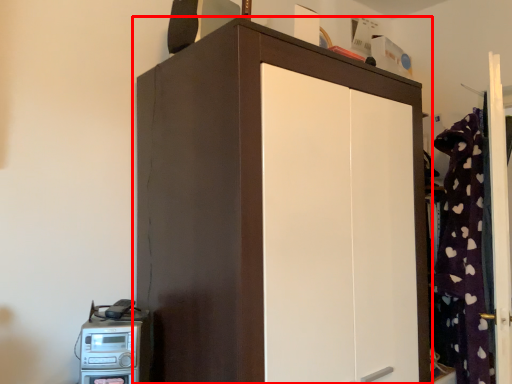
Question: Observing the image, what is the correct spatial positioning of cupboard (annotated by the red box) in reference to home appliance?

Choices:
 (A) right
 (B) left

Answer: (A)